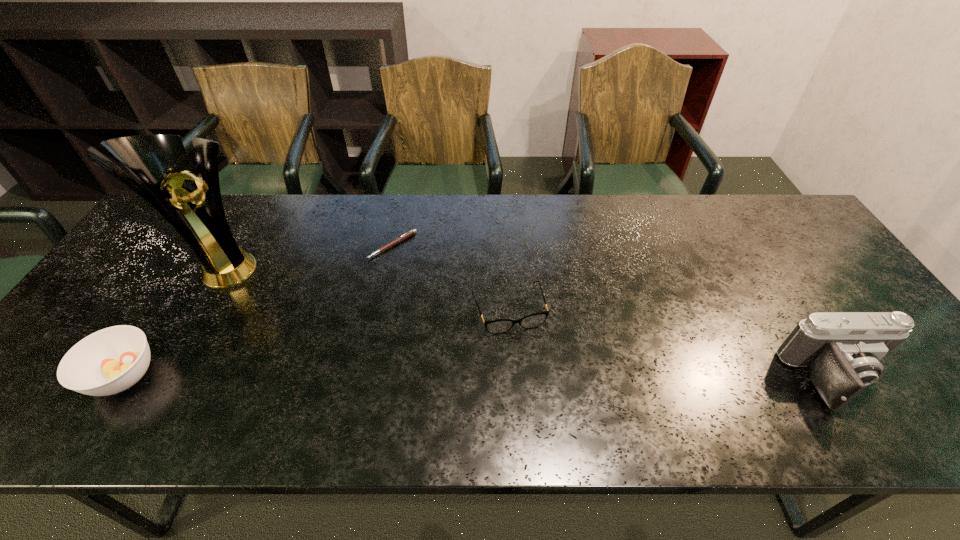
Locate an element on the screen. vacant space on the desktop that is between the soup bowl and the camera and is positioned at the nib of the pen is located at coordinates (406, 377).

The image size is (960, 540). What are the coordinates of `vacant space on the desktop that is between the third tallest object and the fourth shortest object and is positioned on the front-facing side of the second object from right to left` in the screenshot? It's located at (531, 378).

Locate an element on the screen. vacant space on the desktop that is between the soup bowl and the camera and is positioned at the front of the tallest object, where the globe is visible is located at coordinates (415, 377).